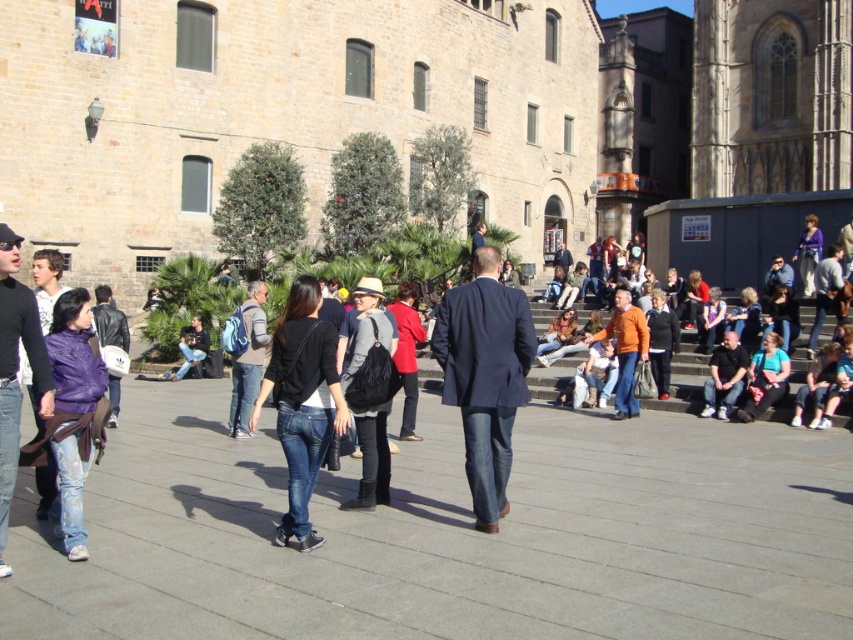
You are a photographer standing at the camera position in the scene. You want to capture a closeup shot of the denim jeans at left. Considering the distance, will you need to use a zoom lens to get a clear photo?

The denim jeans at left is 33.76 feet away from camera. To capture a clear closeup shot from that distance, you would need to use a zoom lens.

You are standing in the plaza and want to determine which of the two points, point (x=4, y=243) or point (x=631, y=362), is nearer to you. Based on the scene, which point is closer?

Point (x=4, y=243) is closer to the viewer than point (x=631, y=362).

You are a photographer trying to capture a candid shot of the navy blue suit at center and denim jeans at left in the bustling plaza. Since you want both subjects to be clearly visible in the frame, which subject should you focus on first to ensure proper focus, considering their heights?

The navy blue suit at center has a lesser height compared to denim jeans at left, so you should focus on the navy blue suit at center first to ensure both are in focus as the denim jeans at left is taller and might be out of focus if focused on the shorter one first.